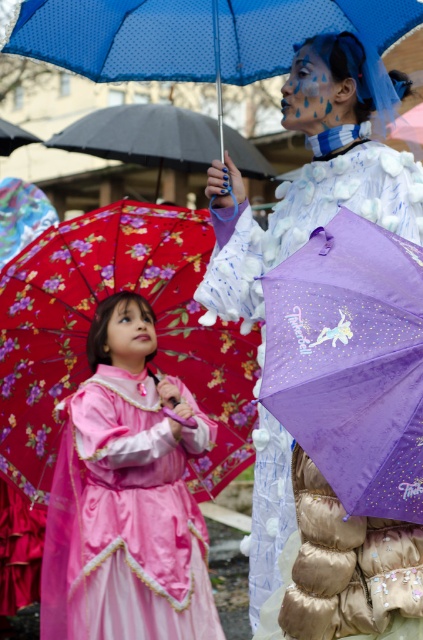
Question: Can you confirm if matte purple umbrella at center is smaller than matte black umbrella at center?

Choices:
 (A) no
 (B) yes

Answer: (B)

Question: Where is gold quilted puffer jacket at center located in relation to matte black umbrella at center in the image?

Choices:
 (A) left
 (B) right

Answer: (B)

Question: Is floral fabric umbrella at left closer to camera compared to floral fabric umbrella at center?

Choices:
 (A) yes
 (B) no

Answer: (B)

Question: Which is farther from the matte black umbrella at center?

Choices:
 (A) matte purple umbrella at center
 (B) floral fabric umbrella at center
 (C) floral fabric umbrella at left
 (D) floral fabric umbrella at upper left

Answer: (A)

Question: Among these points, which one is nearest to the camera?

Choices:
 (A) (126, 228)
 (B) (414, 538)

Answer: (B)

Question: Considering the real-world distances, which object is farthest from the purple fabric umbrella at center?

Choices:
 (A) floral fabric umbrella at left
 (B) matte black umbrella at center

Answer: (B)